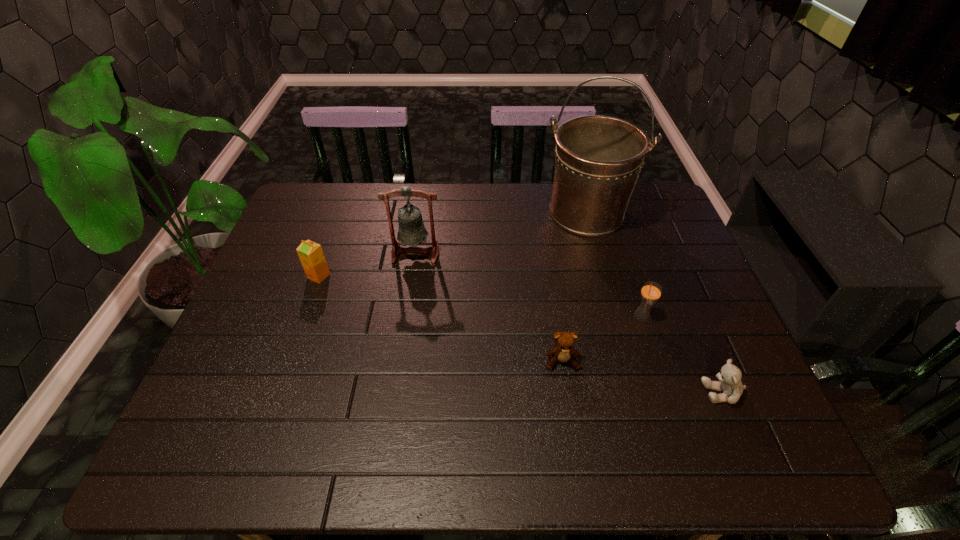
Where is `the tallest object`? The height and width of the screenshot is (540, 960). the tallest object is located at coordinates (598, 159).

I want to click on bucket, so click(x=598, y=159).

Find the location of a particular element. The image size is (960, 540). the fifth shortest object is located at coordinates (412, 231).

Locate an element on the screen. bell is located at coordinates (412, 231).

Identify the location of straw. Image resolution: width=960 pixels, height=540 pixels. (651, 291).

Identify the location of the leftmost object. (311, 255).

Find the location of a particular element. The image size is (960, 540). the third farthest object is located at coordinates (311, 255).

Find the location of `the fifth farthest object`. the fifth farthest object is located at coordinates (564, 349).

I want to click on the farther teddy bear, so click(564, 349).

The image size is (960, 540). I want to click on the nearer teddy bear, so click(x=729, y=377).